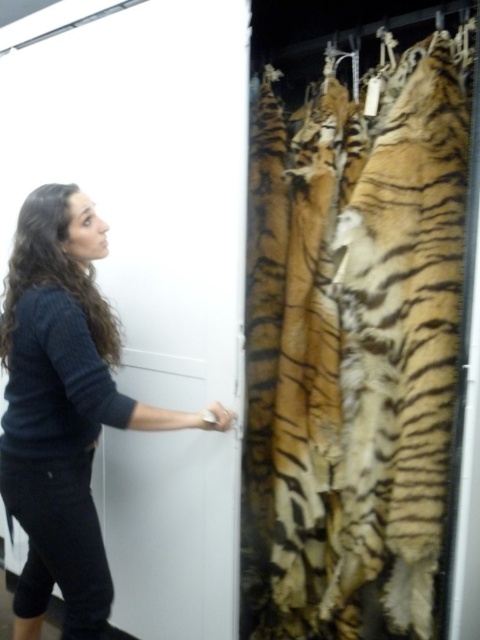
This screenshot has height=640, width=480. What are the coordinates of `orange-brown fur tiger at right` in the screenshot? It's located at (357, 352).

Between orange-brown fur tiger at right and dark blue sweater at center, which one appears on the left side from the viewer's perspective?

Positioned to the left is dark blue sweater at center.

Identify the location of orange-brown fur tiger at right. This screenshot has width=480, height=640. (357, 352).